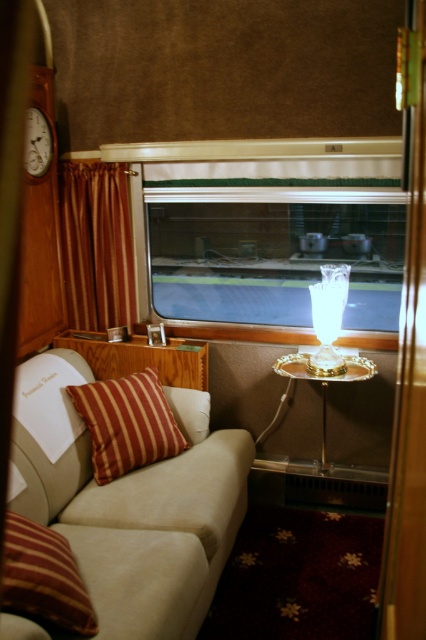
Question: Can you confirm if clear glass window at center is positioned above wooden clock at upper left?

Choices:
 (A) yes
 (B) no

Answer: (B)

Question: Which object is the closest to the striped fabric pillow at lower left?

Choices:
 (A) white glass lamp at center
 (B) velvet burgundy curtain at left
 (C) gold metallic side table at center

Answer: (C)

Question: In this image, where is beige fabric couch at center located relative to wooden clock at upper left?

Choices:
 (A) left
 (B) right

Answer: (B)

Question: Which object is closer to the camera taking this photo?

Choices:
 (A) beige fabric couch at center
 (B) striped fabric pillow at lower left
 (C) gold metallic side table at center
 (D) striped fabric pillow at center

Answer: (B)

Question: Is clear glass window at center positioned in front of striped fabric pillow at lower left?

Choices:
 (A) no
 (B) yes

Answer: (A)

Question: Among these points, which one is farthest from the camera?

Choices:
 (A) (325, 460)
 (B) (169, 632)

Answer: (A)